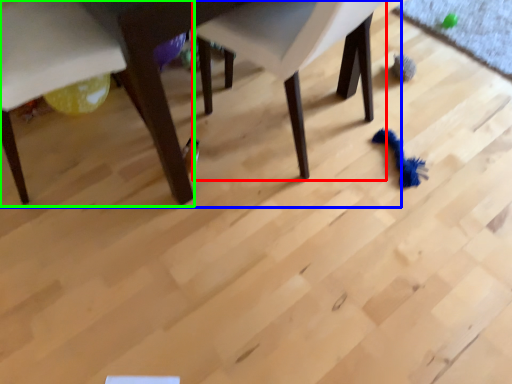
Question: Considering the real-world distances, which object is closest to chair (highlighted by a red box)? table (highlighted by a blue box) or chair (highlighted by a green box).

Choices:
 (A) table
 (B) chair

Answer: (A)